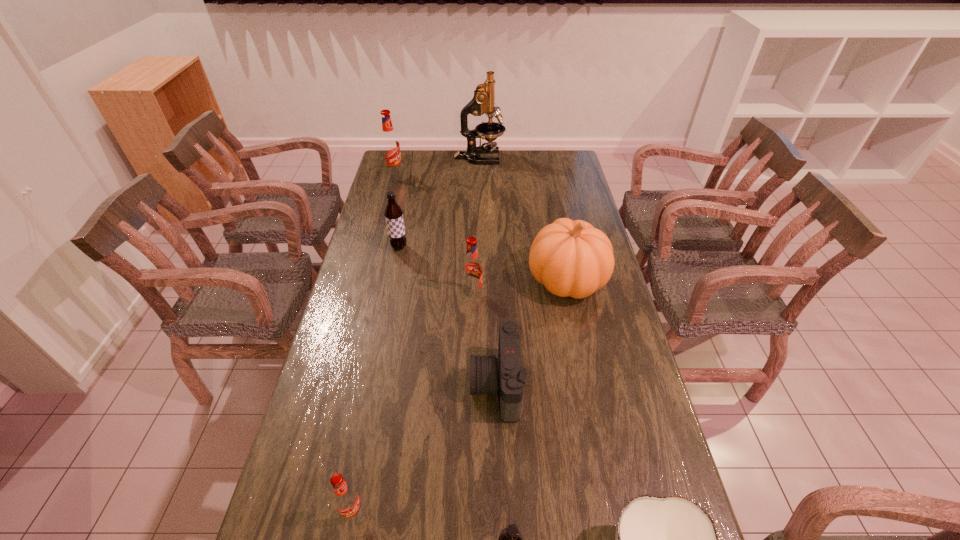
Point out which red root beer is positioned as the second nearest to the farther brown root beer. Please provide its 2D coordinates. Your answer should be formatted as a tuple, i.e. [(x, y)], where the tuple contains the x and y coordinates of a point satisfying the conditions above.

[(390, 146)]

Where is `the closest red root beer to the sixth farthest object`? This screenshot has height=540, width=960. the closest red root beer to the sixth farthest object is located at coordinates (472, 268).

Where is `free spot that satisfies the following two spatial constraints: 1. on the front side of the second nearest red root beer; 2. on the right side of the fourth nearest root beer`? Image resolution: width=960 pixels, height=540 pixels. free spot that satisfies the following two spatial constraints: 1. on the front side of the second nearest red root beer; 2. on the right side of the fourth nearest root beer is located at coordinates (390, 294).